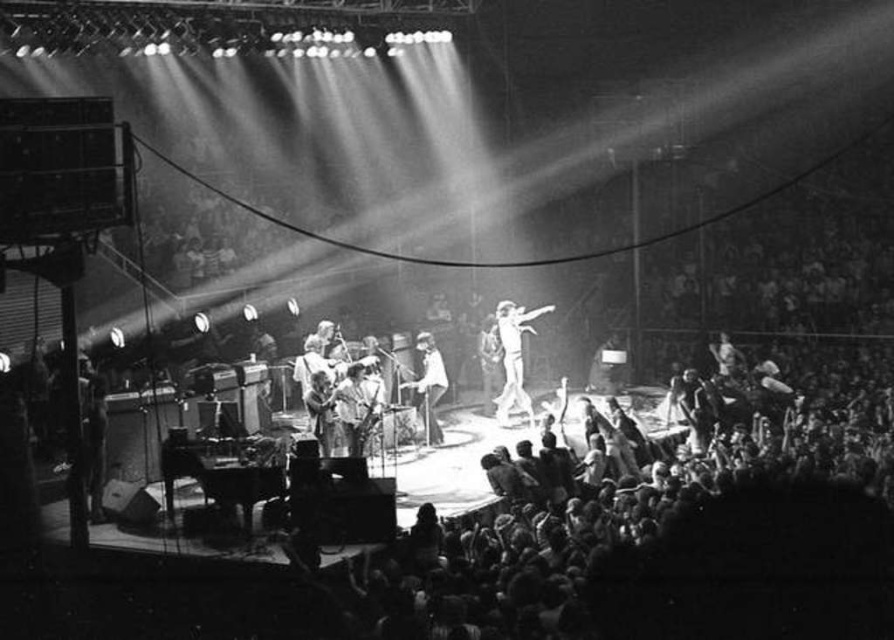
Question: Does white fabric outfit at center have a larger size compared to smooth white shirt at center?

Choices:
 (A) yes
 (B) no

Answer: (B)

Question: Which point appears farthest from the camera in this image?

Choices:
 (A) (513, 356)
 (B) (418, 412)

Answer: (A)

Question: Which of the following is the farthest from the observer?

Choices:
 (A) white fabric outfit at center
 (B) smooth white shirt at center

Answer: (A)

Question: Is white fabric outfit at center below smooth white shirt at center?

Choices:
 (A) yes
 (B) no

Answer: (B)

Question: Can you confirm if white fabric outfit at center is smaller than smooth white shirt at center?

Choices:
 (A) yes
 (B) no

Answer: (A)